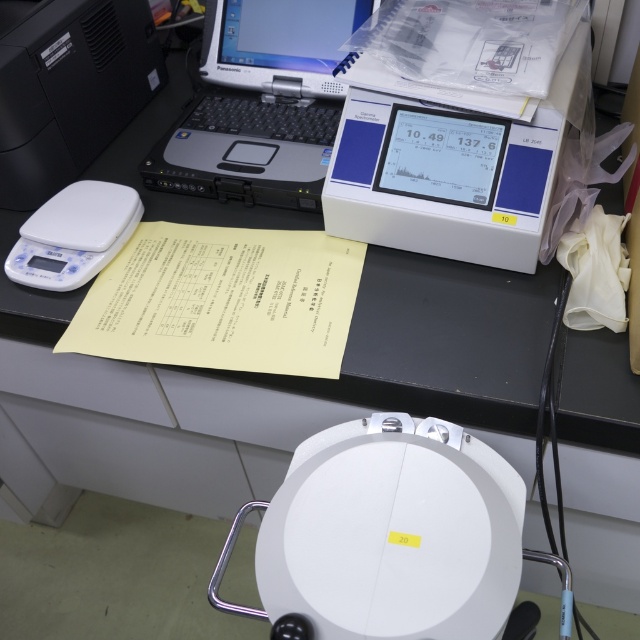
Question: Which object appears farthest from the camera in this image?

Choices:
 (A) white matte scale at left
 (B) silver/black plastic laptop at upper center
 (C) black plastic printer at upper left

Answer: (B)

Question: Can you confirm if yellow paper at center is wider than white matte scale at left?

Choices:
 (A) yes
 (B) no

Answer: (A)

Question: Does silver/black plastic laptop at upper center appear over black plastic printer at upper left?

Choices:
 (A) no
 (B) yes

Answer: (A)

Question: From the image, what is the correct spatial relationship of yellow paper at center in relation to silver/black plastic laptop at upper center?

Choices:
 (A) below
 (B) above

Answer: (A)

Question: Estimate the real-world distances between objects in this image. Which object is closer to the white matte scale at left?

Choices:
 (A) yellow paper at center
 (B) black plastic printer at upper left

Answer: (B)

Question: Which point is farther to the camera?

Choices:
 (A) (74, 116)
 (B) (64, 216)

Answer: (A)